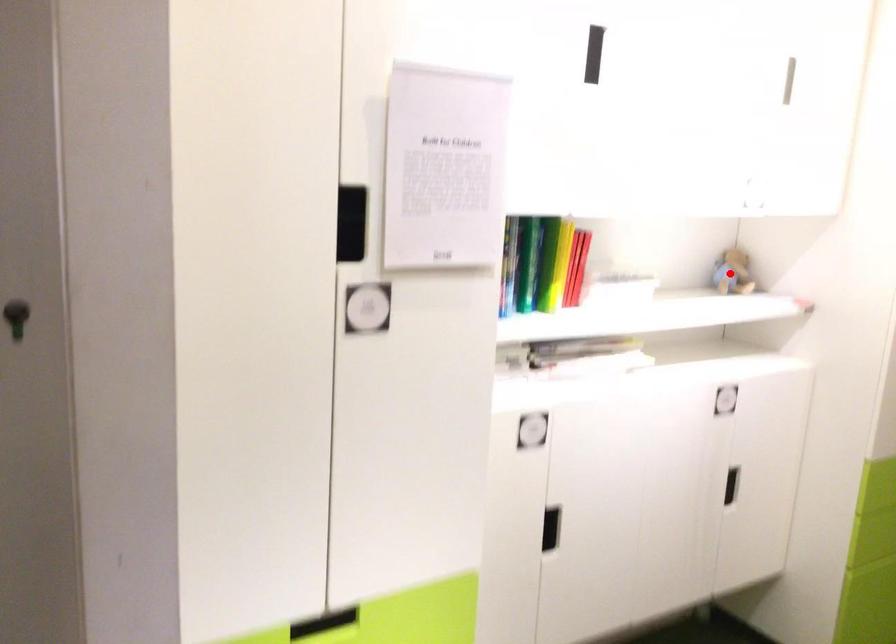
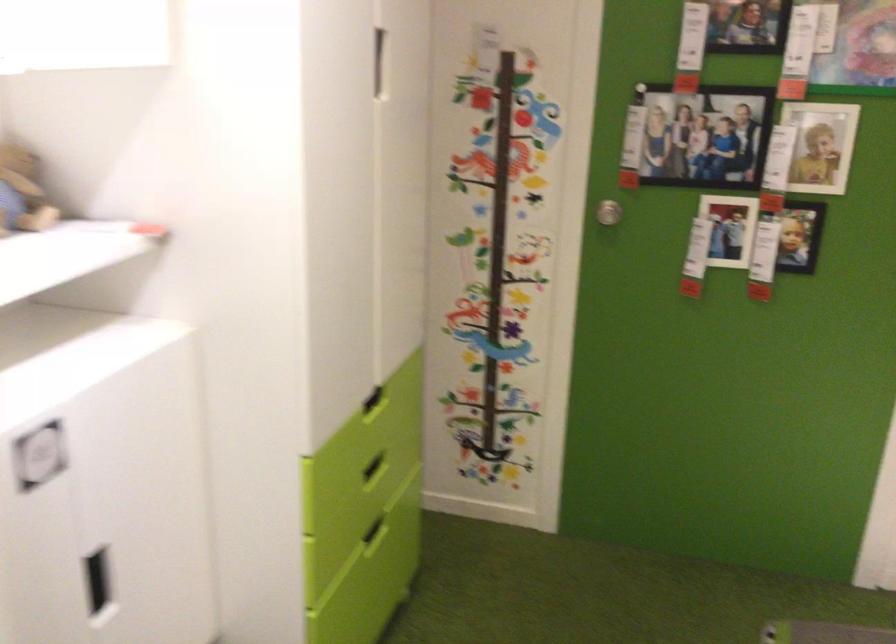
Question: I am providing you with two images of the same scene from different viewpoints. A red point is marked on the first image. Is the red point's position out of view in image 2?

Choices:
 (A) Yes
 (B) No

Answer: (B)